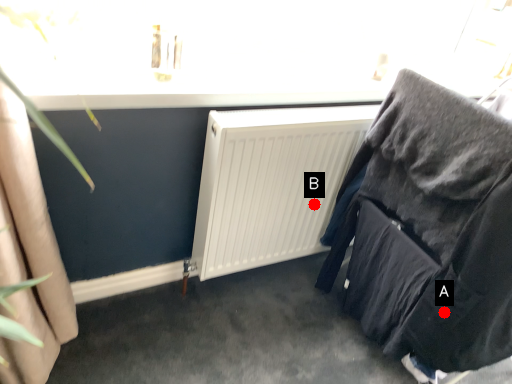
Question: Two points are circled on the image, labeled by A and B beside each circle. Which point is further to the camera?

Choices:
 (A) A is further
 (B) B is further

Answer: (B)